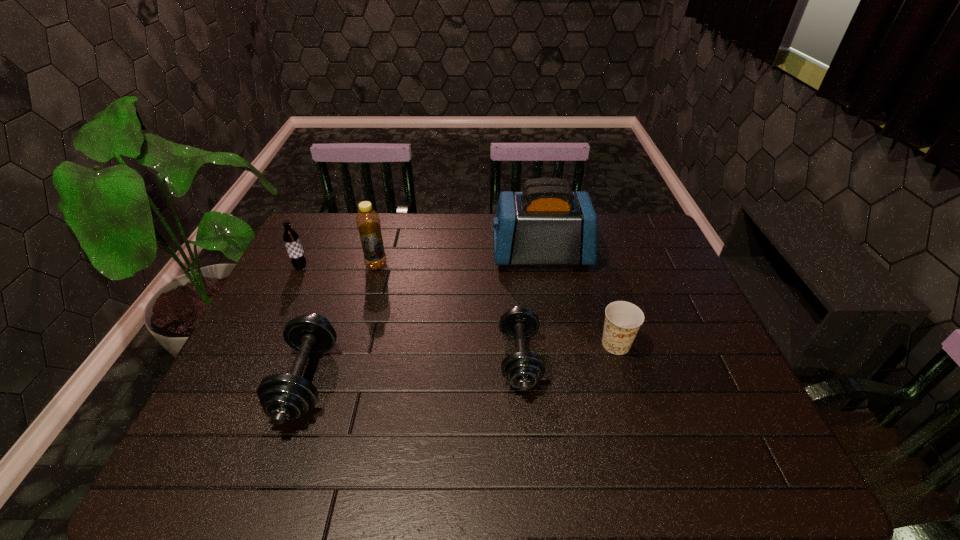
Where is `free point located 0.130m on the front-facing side of the toaster`? free point located 0.130m on the front-facing side of the toaster is located at coordinates (453, 255).

Locate an element on the screen. vacant region located 0.240m on the front-facing side of the toaster is located at coordinates (419, 255).

Locate an element on the screen. Image resolution: width=960 pixels, height=540 pixels. blank space located 0.260m on the back of the bottle is located at coordinates (391, 214).

Locate an element on the screen. Image resolution: width=960 pixels, height=540 pixels. free space located on the front of the root beer is located at coordinates (288, 293).

The width and height of the screenshot is (960, 540). I want to click on vacant space located 0.190m on the front of the Dixie cup, so click(640, 427).

You are a GUI agent. You are given a task and a screenshot of the screen. Output one action in this format:
    pyautogui.click(x=<x>, y=<y>)
    Task: Click on the object that is at the far edge
    This screenshot has width=960, height=540.
    Given the screenshot: What is the action you would take?
    pyautogui.click(x=547, y=224)

Identify the location of dumbbell located in the left edge section of the desktop. The width and height of the screenshot is (960, 540). (284, 397).

Find the location of a particular element. The height and width of the screenshot is (540, 960). root beer present at the left edge is located at coordinates (291, 239).

Image resolution: width=960 pixels, height=540 pixels. What are the coordinates of `object that is at the near left corner` in the screenshot? It's located at click(x=284, y=397).

Identify the location of blank space at the far edge of the desktop. (442, 239).